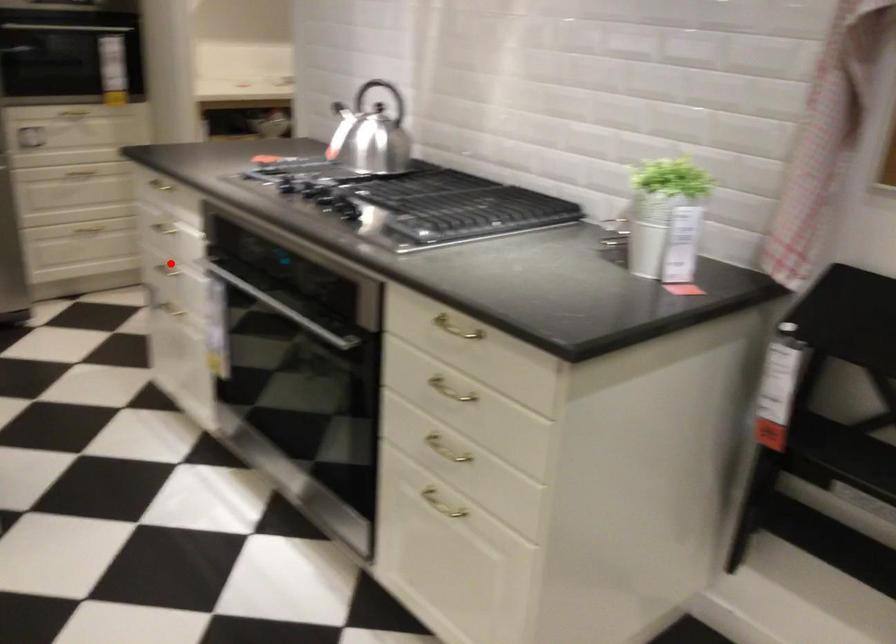
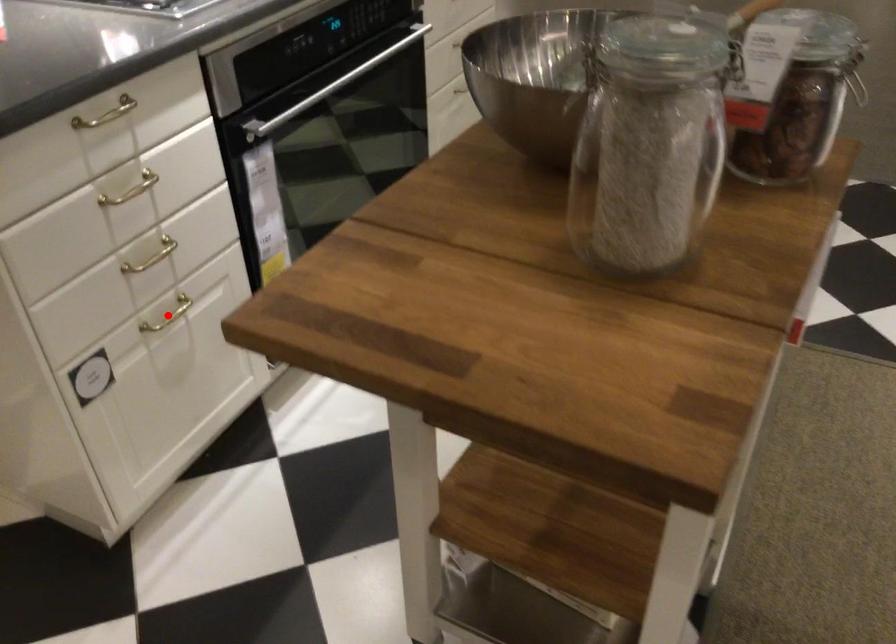
I am providing you with two images of the same scene from different viewpoints. A red point is marked on the first image and another point is marked on the second image. Do the highlighted points in image1 and image2 indicate the same real-world spot?

No